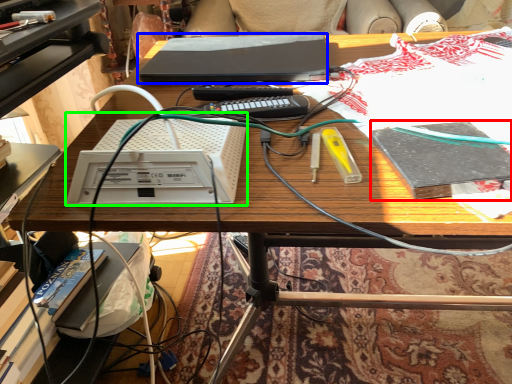
Question: Based on their relative distances, which object is farther from book (highlighted by a red box)? Choose from computer (highlighted by a blue box) and equipment (highlighted by a green box).

Choices:
 (A) computer
 (B) equipment

Answer: (A)